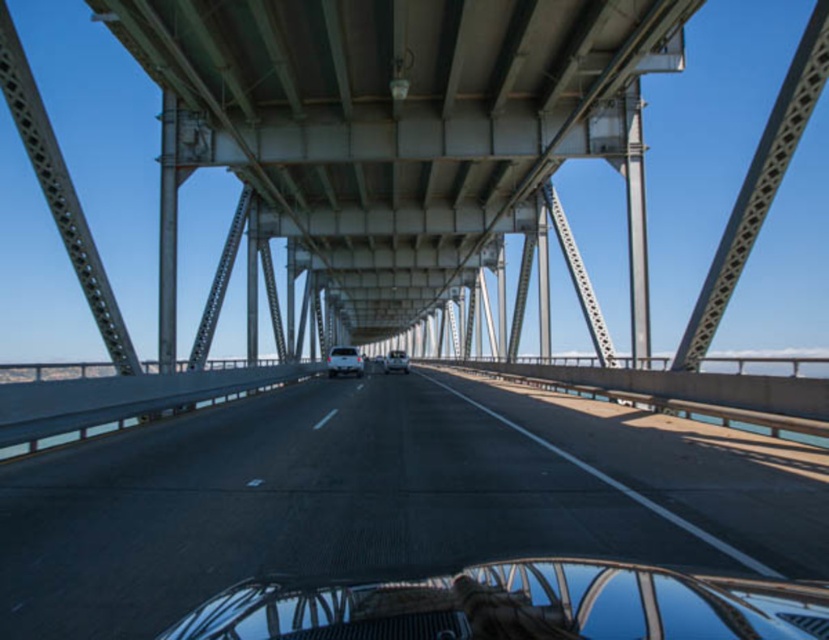
Which is below, clear glass windshield at center or satin silver sedan at center?

satin silver sedan at center is lower down.

Can you confirm if clear glass windshield at center is thinner than satin silver sedan at center?

Yes.

Which is behind, point (525, 637) or point (391, 355)?

Positioned behind is point (391, 355).

Find the location of a particular element. clear glass windshield at center is located at coordinates (517, 605).

Is metallic gray suspension bridge at center further to camera compared to white glossy car at center?

That is False.

Does metallic gray suspension bridge at center have a greater width compared to white glossy car at center?

Yes, metallic gray suspension bridge at center is wider than white glossy car at center.

Does point (129, 406) come farther from viewer compared to point (356, 358)?

No, (129, 406) is closer to viewer.

Find the location of `metallic gray suspension bridge at center`. metallic gray suspension bridge at center is located at coordinates (379, 141).

Does metallic gray suspension bridge at center appear on the right side of clear glass windshield at center?

In fact, metallic gray suspension bridge at center is to the left of clear glass windshield at center.

Who is more forward, [389,179] or [781,605]?

Point [781,605] is in front.

Which is in front, point (493, 51) or point (735, 616)?

Point (735, 616) is in front.

At what (x,y) coordinates should I click in order to perform the action: click on metallic gray suspension bridge at center. Please return your answer as a coordinate pair (x, y). The height and width of the screenshot is (640, 829). Looking at the image, I should click on (379, 141).